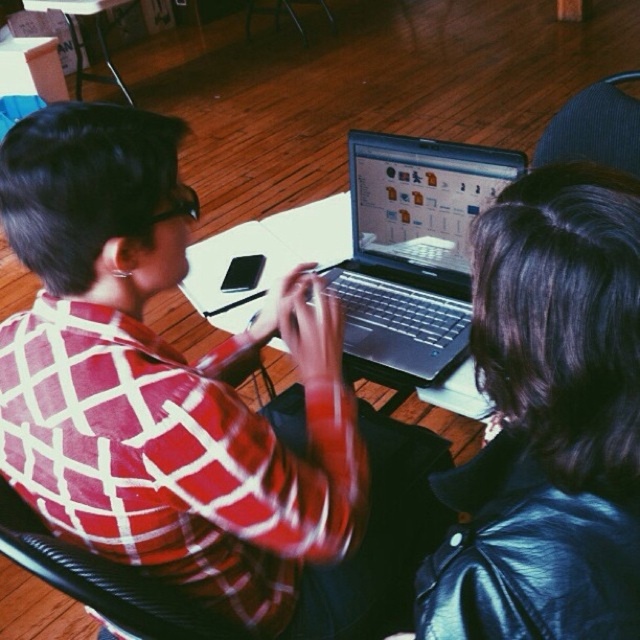
Question: Which of the following is the closest to the observer?

Choices:
 (A) blue fabric chair at upper right
 (B) plaid fabric chair at center
 (C) satin silver laptop at center
 (D) black leather jacket at center

Answer: (D)

Question: Which of the following is the closest to the observer?

Choices:
 (A) satin silver laptop at center
 (B) plaid fabric chair at center
 (C) blue fabric chair at upper right

Answer: (B)

Question: Can you confirm if satin silver laptop at center is positioned below blue fabric chair at upper right?

Choices:
 (A) yes
 (B) no

Answer: (A)

Question: Observing the image, what is the correct spatial positioning of plaid fabric chair at center in reference to blue fabric chair at upper right?

Choices:
 (A) below
 (B) above

Answer: (A)

Question: Is satin silver laptop at center above plaid fabric chair at center?

Choices:
 (A) no
 (B) yes

Answer: (B)

Question: Which object is farther from the camera taking this photo?

Choices:
 (A) black leather jacket at center
 (B) satin silver laptop at center
 (C) blue fabric chair at upper right

Answer: (C)